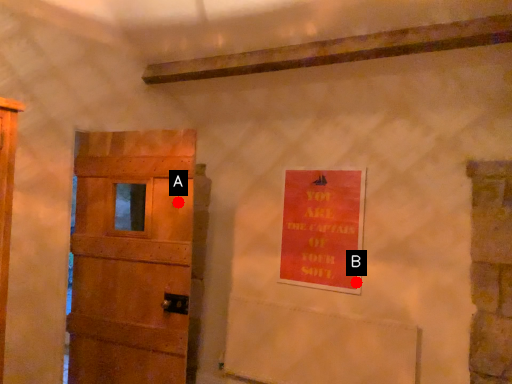
Question: Two points are circled on the image, labeled by A and B beside each circle. Which point is farther to the camera?

Choices:
 (A) A is further
 (B) B is further

Answer: (B)